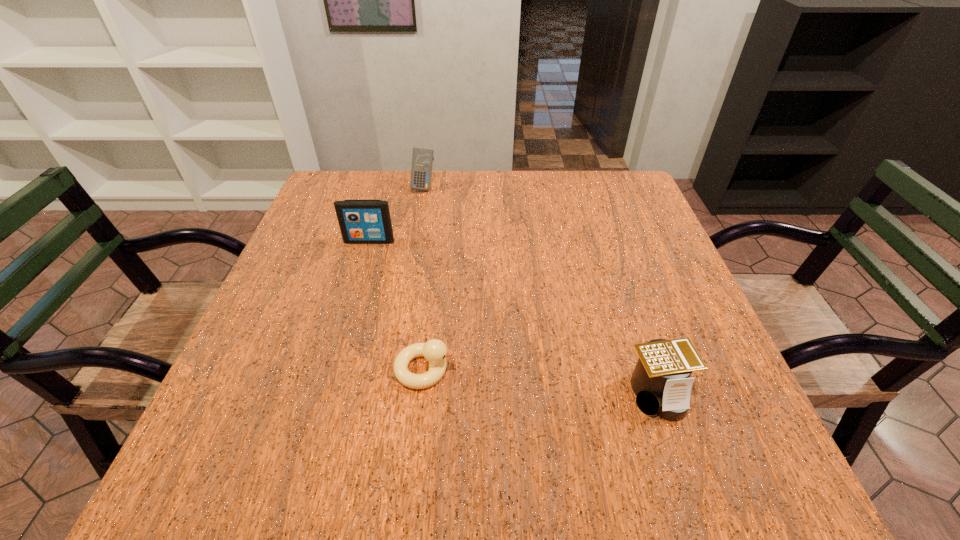
The width and height of the screenshot is (960, 540). Find the location of `the left calculator`. the left calculator is located at coordinates (422, 159).

Locate an element on the screen. the farthest object is located at coordinates (422, 159).

The height and width of the screenshot is (540, 960). Identify the location of iPod. (361, 221).

Identify the location of the leftmost object. This screenshot has height=540, width=960. (361, 221).

This screenshot has width=960, height=540. What are the coordinates of `the right calculator` in the screenshot? It's located at (661, 381).

Locate an element on the screen. the shorter calculator is located at coordinates (661, 381).

This screenshot has height=540, width=960. I want to click on the shortest object, so click(x=435, y=351).

Image resolution: width=960 pixels, height=540 pixels. What are the coordinates of `vacant space located on the front-facing side of the left calculator` in the screenshot? It's located at (407, 282).

Where is `free spot located 0.360m on the front screen of the iPod`? free spot located 0.360m on the front screen of the iPod is located at coordinates (332, 367).

Locate an element on the screen. The width and height of the screenshot is (960, 540). vacant point located on the left of the second shortest object is located at coordinates (502, 393).